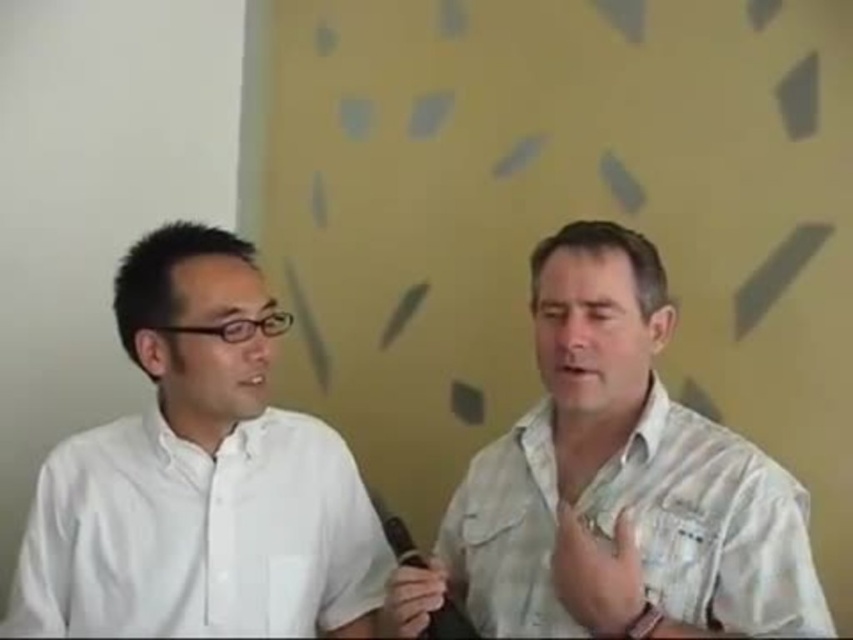
Question: Is white smooth shirt at left positioned in front of black rubber microphone at center?

Choices:
 (A) no
 (B) yes

Answer: (A)

Question: Does white textured shirt at center appear on the left side of black rubber microphone at center?

Choices:
 (A) yes
 (B) no

Answer: (B)

Question: Among these points, which one is nearest to the camera?

Choices:
 (A) (447, 637)
 (B) (55, 477)

Answer: (A)

Question: Estimate the real-world distances between objects in this image. Which object is closer to the white textured shirt at center?

Choices:
 (A) white smooth shirt at left
 (B) black rubber microphone at center

Answer: (B)

Question: Which of the following is the farthest from the observer?

Choices:
 (A) white smooth shirt at left
 (B) black rubber microphone at center

Answer: (A)

Question: Can you confirm if white smooth shirt at left is positioned below black rubber microphone at center?

Choices:
 (A) yes
 (B) no

Answer: (B)